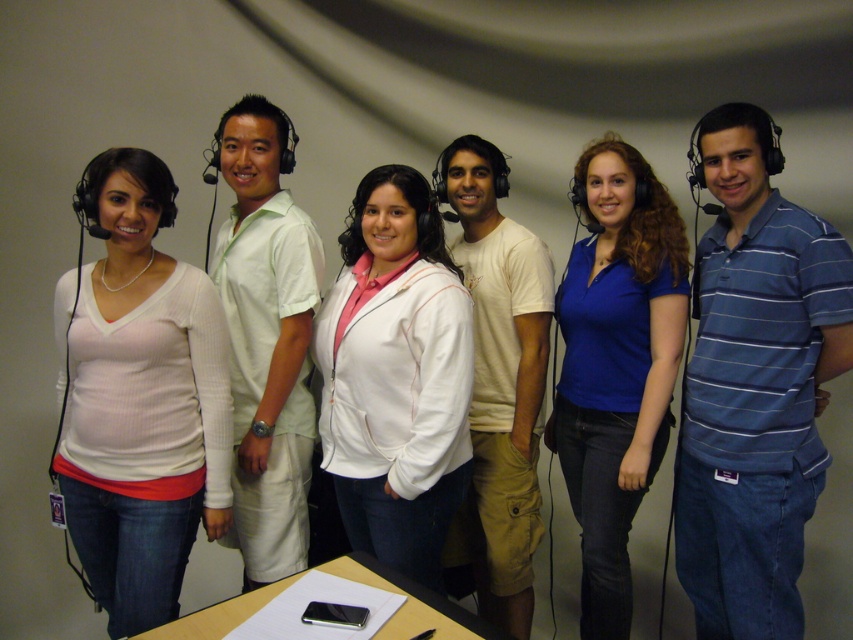
Which is behind, point (637, 317) or point (262, 160)?

Point (262, 160)

Locate an element on the screen. The image size is (853, 640). blue matte shirt at center is located at coordinates (616, 365).

At what (x,y) coordinates should I click in order to perform the action: click on blue matte shirt at center. Please return your answer as a coordinate pair (x, y). The height and width of the screenshot is (640, 853). Looking at the image, I should click on (616, 365).

Who is shorter, white ribbed sweater at left or smooth wooden table at center?

Standing shorter between the two is smooth wooden table at center.

Is point (157, 406) farther from viewer compared to point (445, 620)?

Yes.

Locate an element on the screen. This screenshot has width=853, height=640. white ribbed sweater at left is located at coordinates (142, 401).

At what (x,y) coordinates should I click in order to perform the action: click on white ribbed sweater at left. Please return your answer as a coordinate pair (x, y). The height and width of the screenshot is (640, 853). Looking at the image, I should click on (142, 401).

Is blue matte shirt at center behind smooth wooden table at center?

Yes, blue matte shirt at center is behind smooth wooden table at center.

Does blue matte shirt at center have a lesser width compared to smooth wooden table at center?

Correct, blue matte shirt at center's width is less than smooth wooden table at center's.

What do you see at coordinates (616, 365) in the screenshot?
I see `blue matte shirt at center` at bounding box center [616, 365].

In order to click on blue matte shirt at center in this screenshot , I will do `click(616, 365)`.